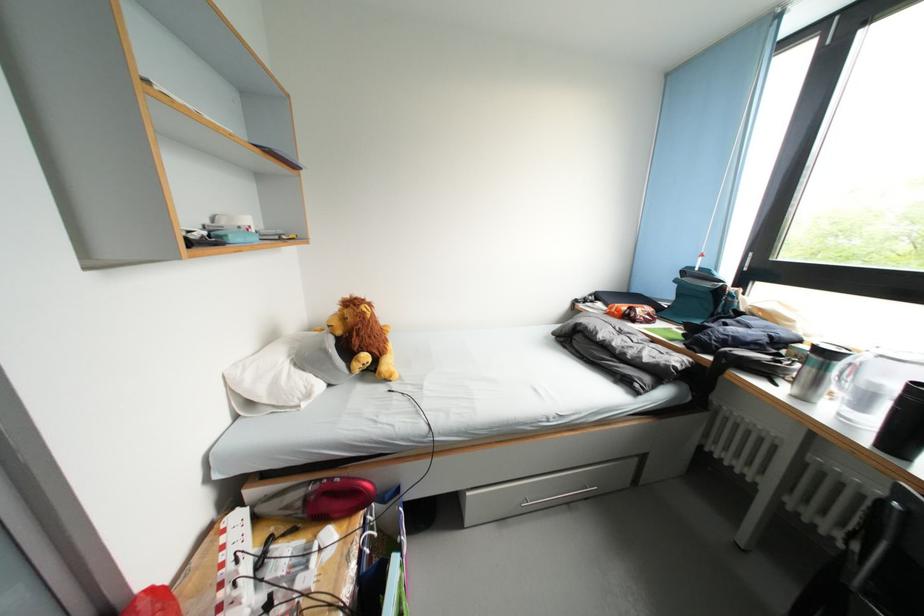
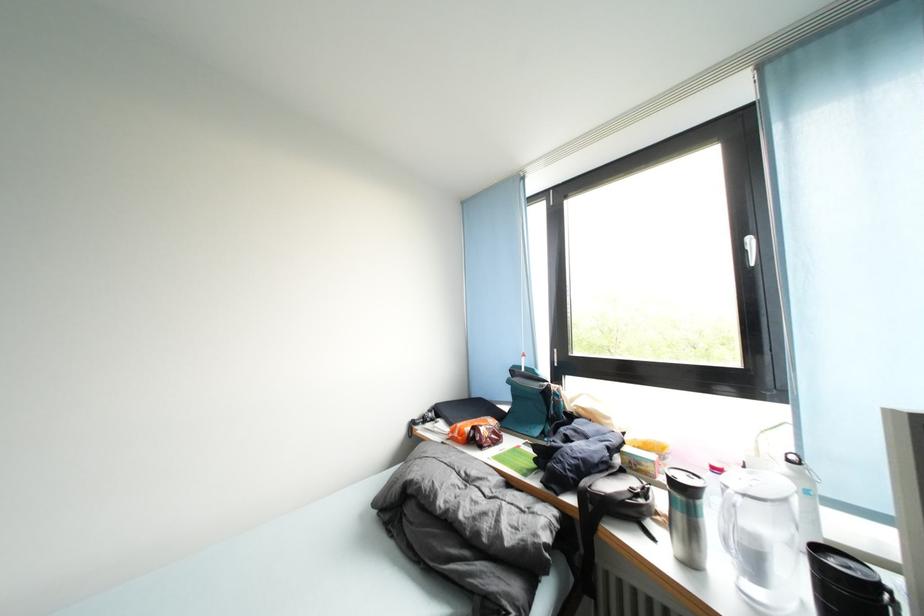
Based on the continuous images, in which direction is the camera rotating?

The camera's rotation is toward right-up.